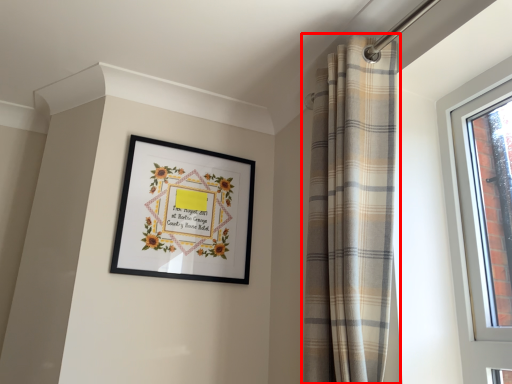
Question: From the image's perspective, what is the correct spatial positioning of curtain (annotated by the red box) in reference to picture frame?

Choices:
 (A) below
 (B) above

Answer: (B)